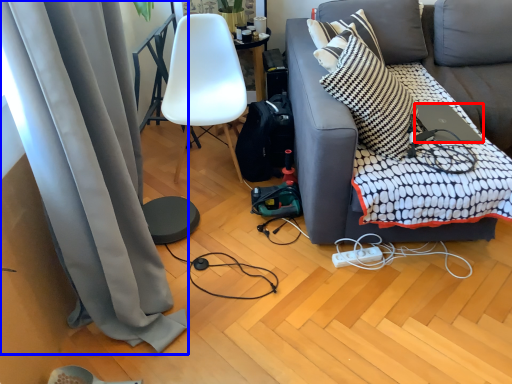
Question: Which of the following is the closest to the observer, laptop (highlighted by a red box) or curtain (highlighted by a blue box)?

Choices:
 (A) laptop
 (B) curtain

Answer: (B)